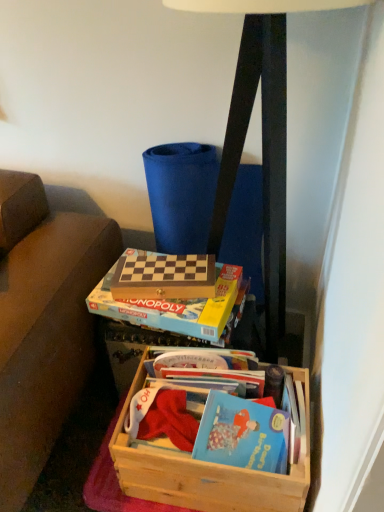
Where is `wooden board game at center, the 1th paperback book in the back-to-front sequence`? The width and height of the screenshot is (384, 512). wooden board game at center, the 1th paperback book in the back-to-front sequence is located at coordinates (x=163, y=276).

Measure the distance between point (x=268, y=261) and camera.

Point (x=268, y=261) is 4.08 feet away from camera.

Identify the location of wooden board game at center, the 1th paperback book in the back-to-front sequence. The image size is (384, 512). (163, 276).

From a real-world perspective, is wooden board game at center, arranged as the second paperback book when viewed from the front, beneath matte black lamp at upper center?

Yes, from a real-world perspective, wooden board game at center, arranged as the second paperback book when viewed from the front, is under matte black lamp at upper center.

Does wooden board game at center, the 1th paperback book in the back-to-front sequence, appear on the left side of matte black lamp at upper center?

Indeed, wooden board game at center, the 1th paperback book in the back-to-front sequence, is positioned on the left side of matte black lamp at upper center.

How many degrees apart are the facing directions of wooden board game at center, the 1th paperback book in the back-to-front sequence, and matte black lamp at upper center?

10.9 degrees.

Which object is further away from the camera taking this photo, wooden board game at center, the 1th paperback book in the back-to-front sequence, or matte black lamp at upper center?

wooden board game at center, the 1th paperback book in the back-to-front sequence, is further from the camera.

Is matte black lamp at upper center directly adjacent to wooden crate at lower center?

No, matte black lamp at upper center is not next to wooden crate at lower center.

Can you tell me how much matte black lamp at upper center and wooden crate at lower center differ in facing direction?

matte black lamp at upper center and wooden crate at lower center are facing 2.39 degrees away from each other.

Who is more distant, matte black lamp at upper center or wooden crate at lower center?

wooden crate at lower center is further from the camera.

Considering the sizes of objects matte black lamp at upper center and wooden crate at lower center in the image provided, who is taller, matte black lamp at upper center or wooden crate at lower center?

matte black lamp at upper center is taller.

Is wooden crate at lower center aimed at matte black lamp at upper center?

No, wooden crate at lower center is not turned towards matte black lamp at upper center.

Can you confirm if wooden crate at lower center is shorter than matte black lamp at upper center?

Yes.

Which of these two, wooden crate at lower center or matte black lamp at upper center, is thinner?

wooden crate at lower center.

The height and width of the screenshot is (512, 384). I want to click on box lying behind the matte black lamp at upper center, so click(205, 469).

Can you confirm if wooden board game at center, the 1th paperback book in the back-to-front sequence, is bigger than hardcover book at center, which is the 2th paperback book from back to front?

Actually, wooden board game at center, the 1th paperback book in the back-to-front sequence, might be smaller than hardcover book at center, which is the 2th paperback book from back to front.

How distant is wooden board game at center, arranged as the second paperback book when viewed from the front, from hardcover book at center, which is counted as the 1th paperback book, starting from the front?

They are 5.04 centimeters apart.

Which point is more distant from viewer, (207,283) or (89,309)?

The point (89,309) is farther from the camera.

Considering the relative sizes of hardcover book at center, which is counted as the 1th paperback book, starting from the front, and matte black lamp at upper center in the image provided, is hardcover book at center, which is counted as the 1th paperback book, starting from the front, smaller than matte black lamp at upper center?

Yes.

Who is shorter, hardcover book at center, which is counted as the 1th paperback book, starting from the front, or matte black lamp at upper center?

With less height is hardcover book at center, which is counted as the 1th paperback book, starting from the front.

From a real-world perspective, relative to matte black lamp at upper center, is hardcover book at center, which is counted as the 1th paperback book, starting from the front, vertically above or below?

Clearly, from a real-world perspective, hardcover book at center, which is counted as the 1th paperback book, starting from the front, is below matte black lamp at upper center.

Does point (147, 351) come closer to viewer compared to point (131, 305)?

No, (147, 351) is behind (131, 305).

Relative to hardcover book at center, which is the 2th paperback book from back to front, is wooden crate at lower center in front or behind?

In the image, wooden crate at lower center appears in front of hardcover book at center, which is the 2th paperback book from back to front.

How different are the orientations of wooden crate at lower center and hardcover book at center, which is the 2th paperback book from back to front, in degrees?

The angular difference between wooden crate at lower center and hardcover book at center, which is the 2th paperback book from back to front, is 7.86 degrees.

Based on the photo, measure the distance between wooden crate at lower center and hardcover book at center, which is the 2th paperback book from back to front.

wooden crate at lower center and hardcover book at center, which is the 2th paperback book from back to front, are 10.68 inches apart.

Is hardcover book at center, which is counted as the 1th paperback book, starting from the front, at the left side of wooden crate at lower center?

Correct, you'll find hardcover book at center, which is counted as the 1th paperback book, starting from the front, to the left of wooden crate at lower center.

Which is in front, point (242, 294) or point (258, 490)?

The point (258, 490) is closer to the camera.

Could wooden crate at lower center be considered to be inside hardcover book at center, which is the 2th paperback book from back to front?

Actually, wooden crate at lower center is outside hardcover book at center, which is the 2th paperback book from back to front.

Looking at this image, based on their sizes in the image, would you say hardcover book at center, which is counted as the 1th paperback book, starting from the front, is bigger or smaller than wooden crate at lower center?

In the image, hardcover book at center, which is counted as the 1th paperback book, starting from the front, appears to be smaller than wooden crate at lower center.

This screenshot has width=384, height=512. Identify the location of table lamp on the right of wooden board game at center, the 1th paperback book in the back-to-front sequence. pyautogui.click(x=262, y=156).

Identify the location of box below the matte black lamp at upper center (from a real-world perspective). The height and width of the screenshot is (512, 384). pos(205,469).

When comparing their distances from matte black lamp at upper center, does hardcover book at center, which is counted as the 1th paperback book, starting from the front, or wooden crate at lower center seem closer?

hardcover book at center, which is counted as the 1th paperback book, starting from the front, lies closer to matte black lamp at upper center than the other object.

When comparing their distances from hardcover book at center, which is counted as the 1th paperback book, starting from the front, does matte black lamp at upper center or wooden board game at center, the 1th paperback book in the back-to-front sequence, seem closer?

wooden board game at center, the 1th paperback book in the back-to-front sequence, is positioned closer to the anchor hardcover book at center, which is counted as the 1th paperback book, starting from the front.

Considering their positions, is wooden crate at lower center positioned further to hardcover book at center, which is the 2th paperback book from back to front, than wooden board game at center, arranged as the second paperback book when viewed from the front?

Among the two, wooden crate at lower center is located further to hardcover book at center, which is the 2th paperback book from back to front.

Looking at the image, which one is located closer to wooden board game at center, the 1th paperback book in the back-to-front sequence, wooden crate at lower center or hardcover book at center, which is counted as the 1th paperback book, starting from the front?

hardcover book at center, which is counted as the 1th paperback book, starting from the front, lies closer to wooden board game at center, the 1th paperback book in the back-to-front sequence, than the other object.

Considering their positions, is wooden crate at lower center positioned closer to matte black lamp at upper center than hardcover book at center, which is the 2th paperback book from back to front?

The object closer to matte black lamp at upper center is hardcover book at center, which is the 2th paperback book from back to front.

Based on their spatial positions, is matte black lamp at upper center or hardcover book at center, which is the 2th paperback book from back to front, closer to wooden crate at lower center?

Among the two, hardcover book at center, which is the 2th paperback book from back to front, is located nearer to wooden crate at lower center.

Considering their positions, is matte black lamp at upper center positioned further to wooden crate at lower center than wooden board game at center, the 1th paperback book in the back-to-front sequence?

matte black lamp at upper center is positioned further to the anchor wooden crate at lower center.

When comparing their distances from hardcover book at center, which is counted as the 1th paperback book, starting from the front, does wooden board game at center, arranged as the second paperback book when viewed from the front, or matte black lamp at upper center seem closer?

wooden board game at center, arranged as the second paperback book when viewed from the front, is positioned closer to the anchor hardcover book at center, which is counted as the 1th paperback book, starting from the front.

Find the location of a particular element. The image size is (384, 512). paperback book between wooden board game at center, arranged as the second paperback book when viewed from the front, and wooden crate at lower center in the up-down direction is located at coordinates (176, 308).

You are a GUI agent. You are given a task and a screenshot of the screen. Output one action in this format:
    pyautogui.click(x=<x>, y=<y>)
    Task: Click on the paperback book located between matte black lamp at upper center and wooden board game at center, the 1th paperback book in the back-to-front sequence, in the depth direction
    The width and height of the screenshot is (384, 512).
    Given the screenshot: What is the action you would take?
    pyautogui.click(x=176, y=308)